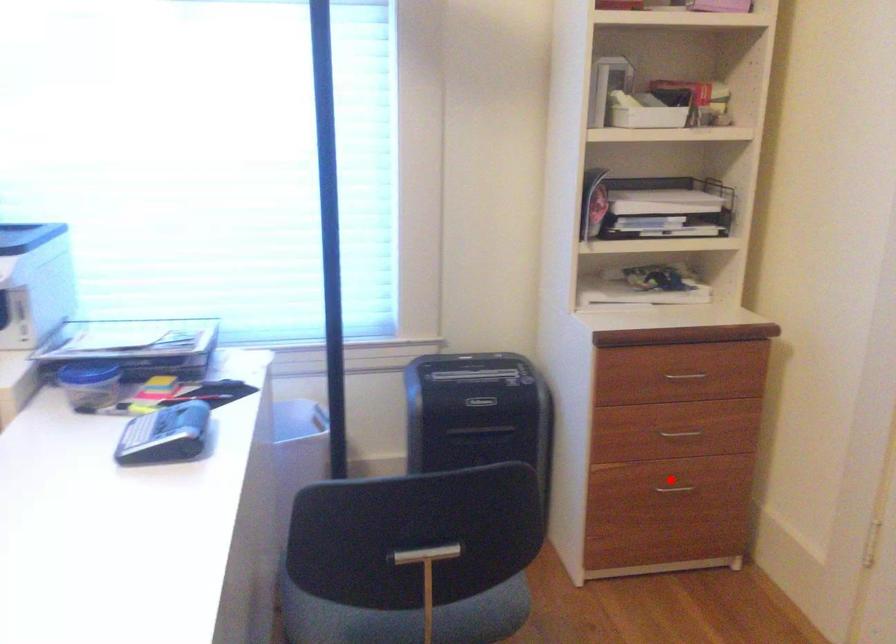
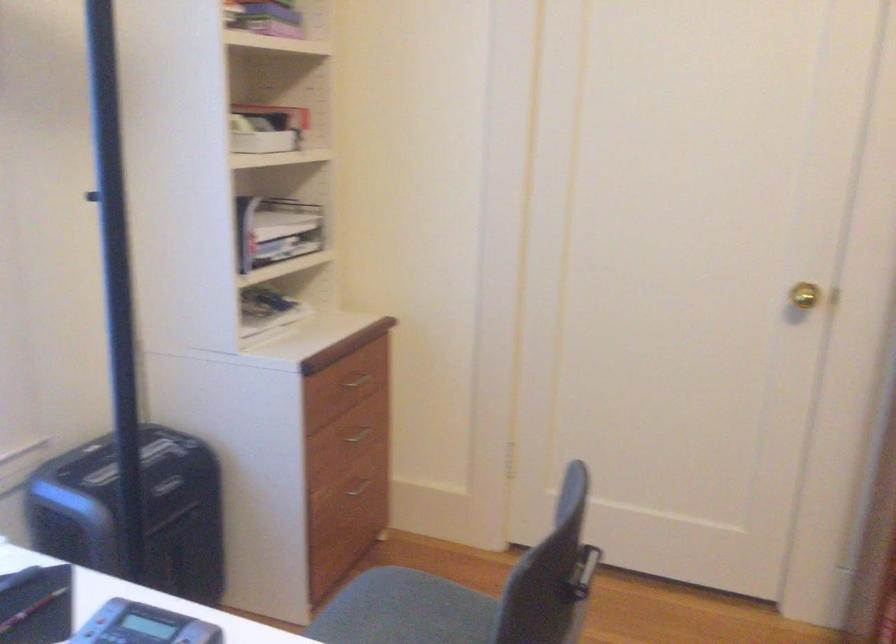
Where in the second image is the point corresponding to the highlighted location from the first image?

(359, 485)